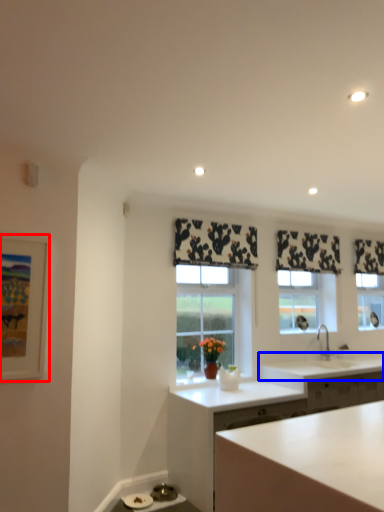
Question: Which object appears farthest to the camera in this image, picture frame (highlighted by a red box) or countertop (highlighted by a blue box)?

Choices:
 (A) picture frame
 (B) countertop

Answer: (B)